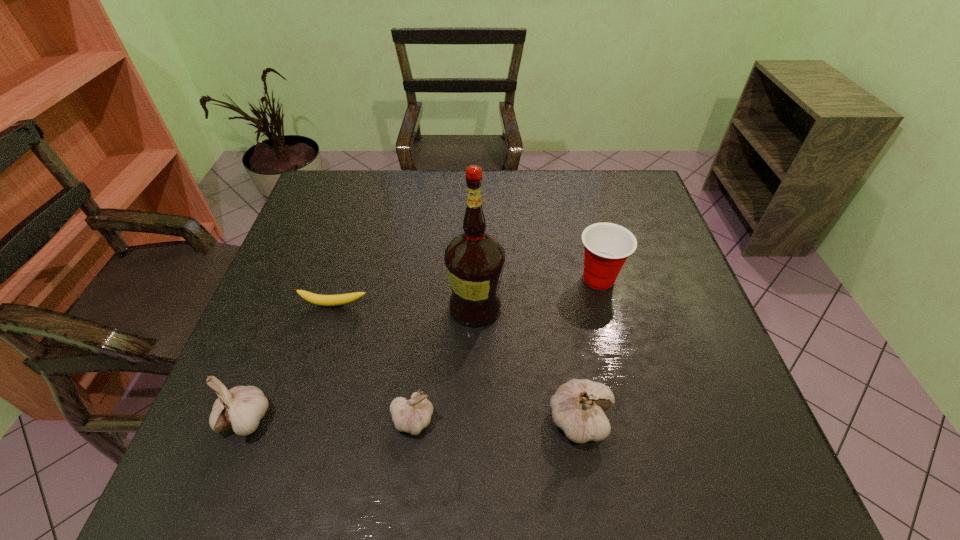
I want to click on free region located 0.250m on the left of the tallest garlic, so click(422, 420).

Where is `vacant position located on the back of the cup`? The height and width of the screenshot is (540, 960). vacant position located on the back of the cup is located at coordinates click(x=574, y=185).

Locate an element on the screen. vacant space located 0.120m on the upward curve of the banana is located at coordinates (321, 350).

In order to click on free region located on the label of the fourth object from left to right in this screenshot , I will do `click(605, 307)`.

You are a GUI agent. You are given a task and a screenshot of the screen. Output one action in this format:
    pyautogui.click(x=<x>, y=<y>)
    Task: Click on the garlic that is at the left edge
    The height and width of the screenshot is (540, 960).
    Given the screenshot: What is the action you would take?
    pyautogui.click(x=242, y=407)

At what (x,y) coordinates should I click in order to perform the action: click on banana situated at the left edge. Please return your answer as a coordinate pair (x, y). The image size is (960, 540). Looking at the image, I should click on (341, 299).

Identify the location of object located at the right edge. (607, 246).

Where is `object positioned at the near left corner`? object positioned at the near left corner is located at coordinates pyautogui.click(x=242, y=407).

In the image, there is a desktop. Identify the location of vacant space at the far edge. The height and width of the screenshot is (540, 960). (373, 171).

Identify the location of vacant area at the left edge of the desktop. This screenshot has width=960, height=540. 287,327.